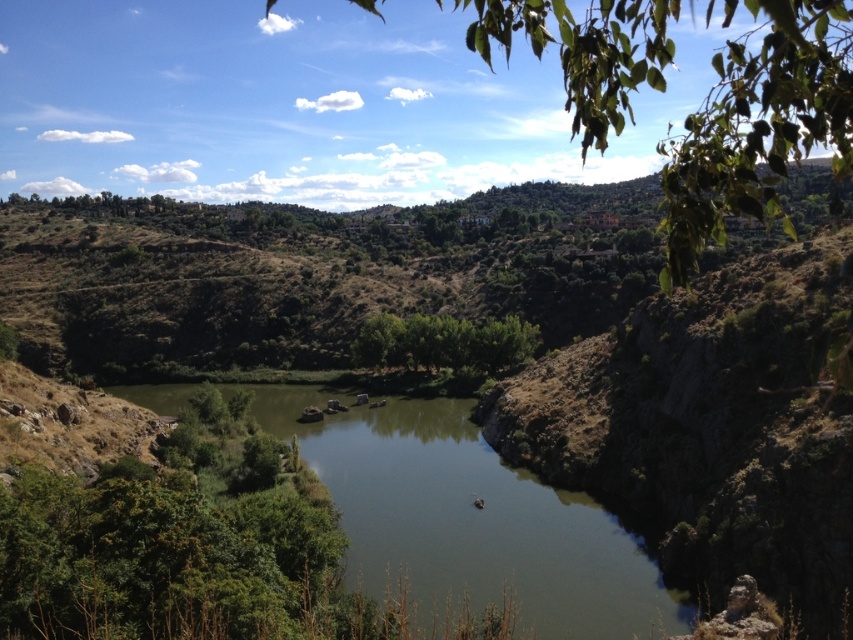
You are a hiker standing at the riverbank and see the green leafy tree at upper center and the green leafy trees at center. Which one is larger in size?

The green leafy tree at upper center is bigger than the green leafy trees at center.